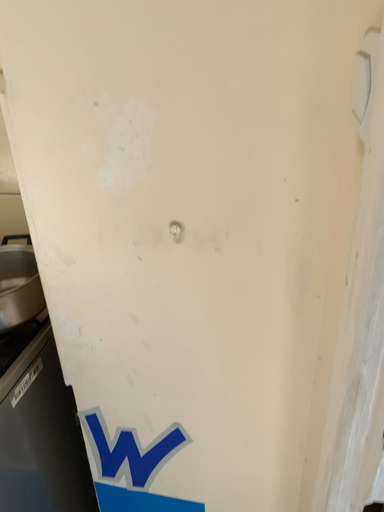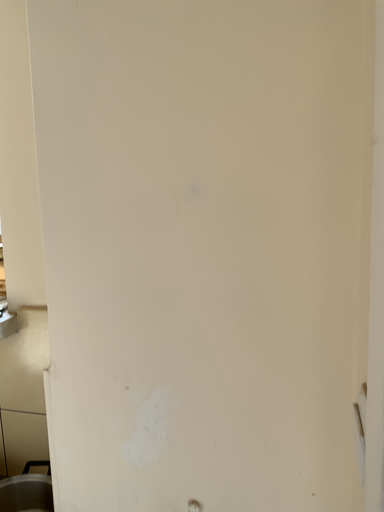
Question: How did the camera likely rotate when shooting the video?

Choices:
 (A) rotated upward
 (B) rotated downward

Answer: (A)